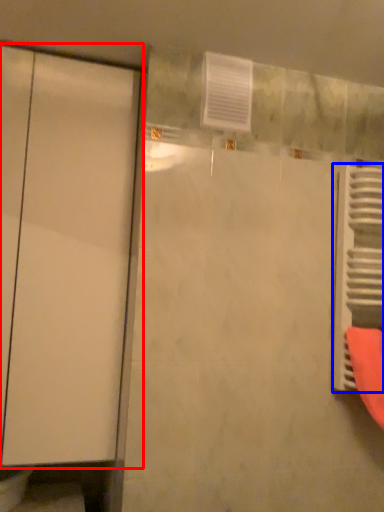
Question: Which point is closer to the camera, door (highlighted by a red box) or radiator (highlighted by a blue box)?

Choices:
 (A) door
 (B) radiator

Answer: (A)